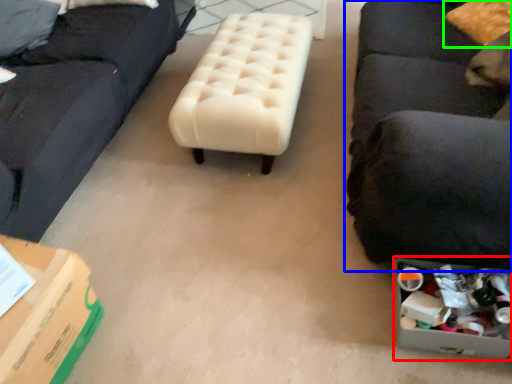
Question: Based on their relative distances, which object is farther from storage box (highlighted by a red box)? Choose from studio couch (highlighted by a blue box) and pillow (highlighted by a green box).

Choices:
 (A) studio couch
 (B) pillow

Answer: (B)